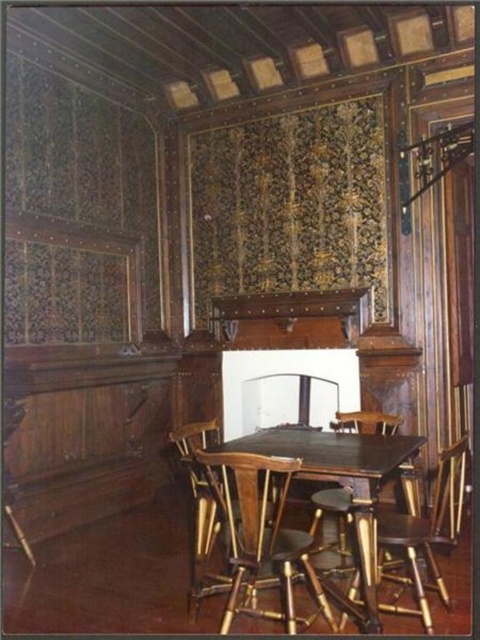
Question: Does wooden table at center appear over wooden chair at center?

Choices:
 (A) yes
 (B) no

Answer: (A)

Question: Is wooden table at center wider than wooden chair at center?

Choices:
 (A) no
 (B) yes

Answer: (B)

Question: Estimate the real-world distances between objects in this image. Which object is closer to the wooden bar stool at center?

Choices:
 (A) wooden barstool at lower right
 (B) wooden table at center

Answer: (A)

Question: Which of the following is the farthest from the observer?

Choices:
 (A) wooden barstool at lower right
 (B) wooden table at center
 (C) wooden bar stool at center
 (D) wooden chair at center

Answer: (D)

Question: In this image, where is wooden table at center located relative to wooden bar stool at center?

Choices:
 (A) right
 (B) left

Answer: (B)

Question: Estimate the real-world distances between objects in this image. Which object is farther from the wooden table at center?

Choices:
 (A) wooden chair at center
 (B) wooden bar stool at center
 (C) wooden barstool at lower right

Answer: (A)